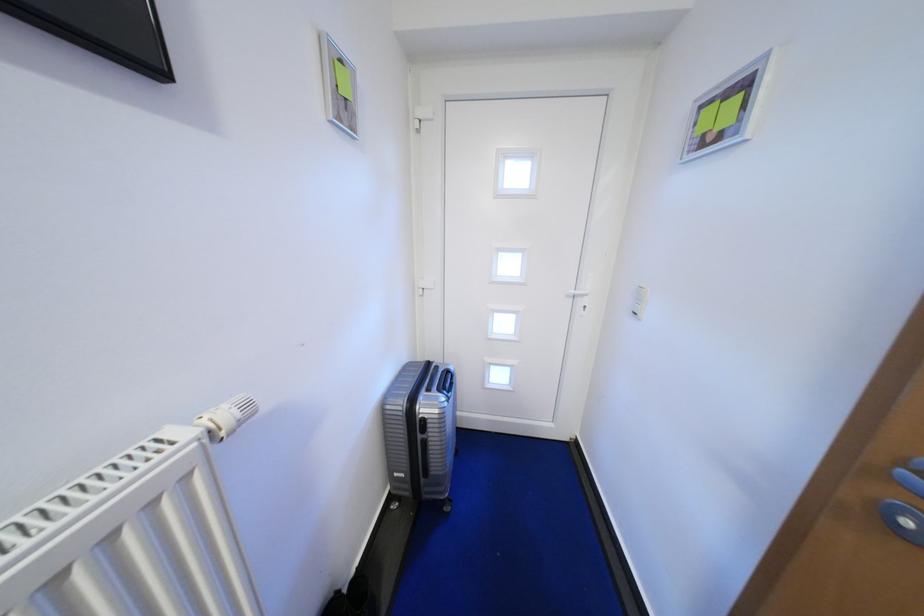
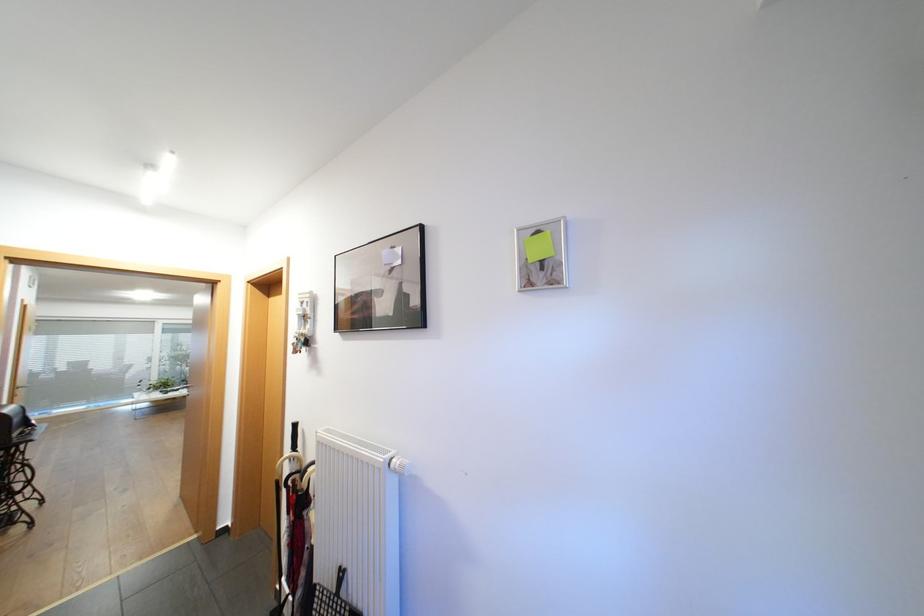
In the second image, find the point that corresponds to point 350,115 in the first image.

(544, 276)